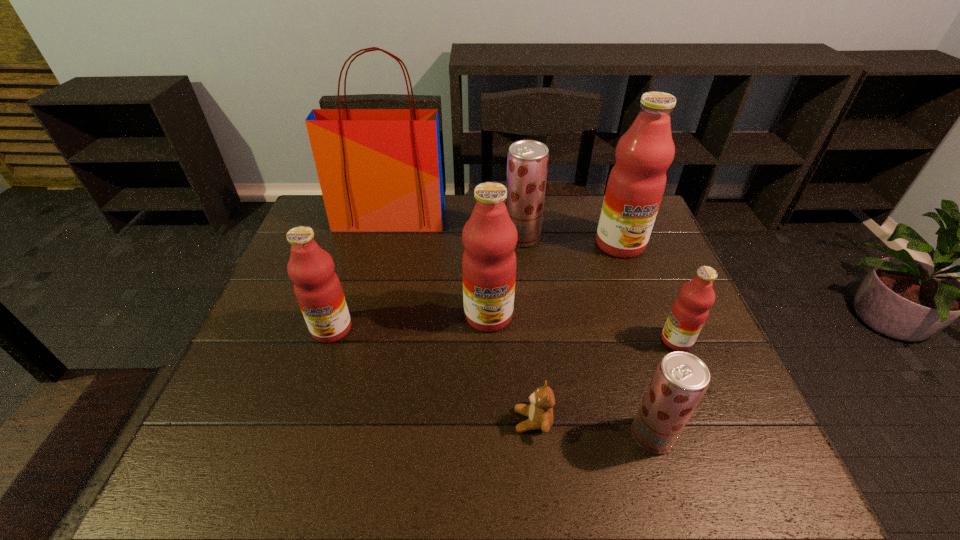
Find the location of a particular element. This screenshot has width=960, height=540. free location located 0.310m on the label of the smallest pink fruit juice is located at coordinates (534, 340).

Locate an element on the screen. The height and width of the screenshot is (540, 960). free point located 0.190m on the back of the nearer strawberry fruit juice is located at coordinates (625, 345).

You are a GUI agent. You are given a task and a screenshot of the screen. Output one action in this format:
    pyautogui.click(x=<x>, y=<y>)
    Task: Click on the blank space located on the front-facing side of the shortest object
    This screenshot has width=960, height=540.
    Given the screenshot: What is the action you would take?
    pyautogui.click(x=404, y=421)

Where is `free space located 0.360m on the front-facing side of the shortest object`? The image size is (960, 540). free space located 0.360m on the front-facing side of the shortest object is located at coordinates pos(342,421).

Identify the location of vacant space located on the front-facing side of the shortest object. point(390,421).

Identify the location of shopping bag situated at the far edge. The image size is (960, 540). (380, 170).

The image size is (960, 540). What are the coordinates of `fruit juice that is at the near edge` in the screenshot? It's located at (681, 379).

Find the location of a particular element. teddy bear present at the near edge is located at coordinates (540, 415).

At what (x,y) coordinates should I click in order to perform the action: click on shopping bag located in the left edge section of the desktop. Please return your answer as a coordinate pair (x, y). Looking at the image, I should click on (380, 170).

Where is `fruit juice at the left edge`? fruit juice at the left edge is located at coordinates pos(318,290).